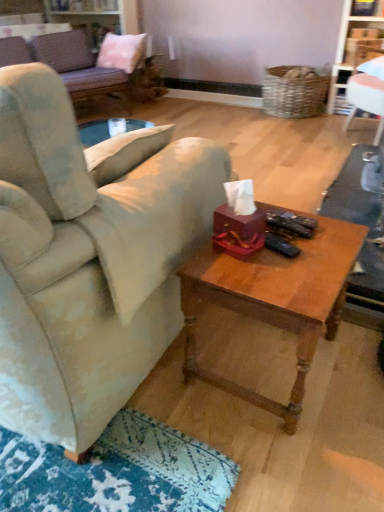
You are a GUI agent. You are given a task and a screenshot of the screen. Output one action in this format:
    pyautogui.click(x=<x>, y=<y>)
    Task: Click on the free location to the right of wooden coffee table at center
    The image size is (384, 512).
    Given the screenshot: What is the action you would take?
    pyautogui.click(x=352, y=367)